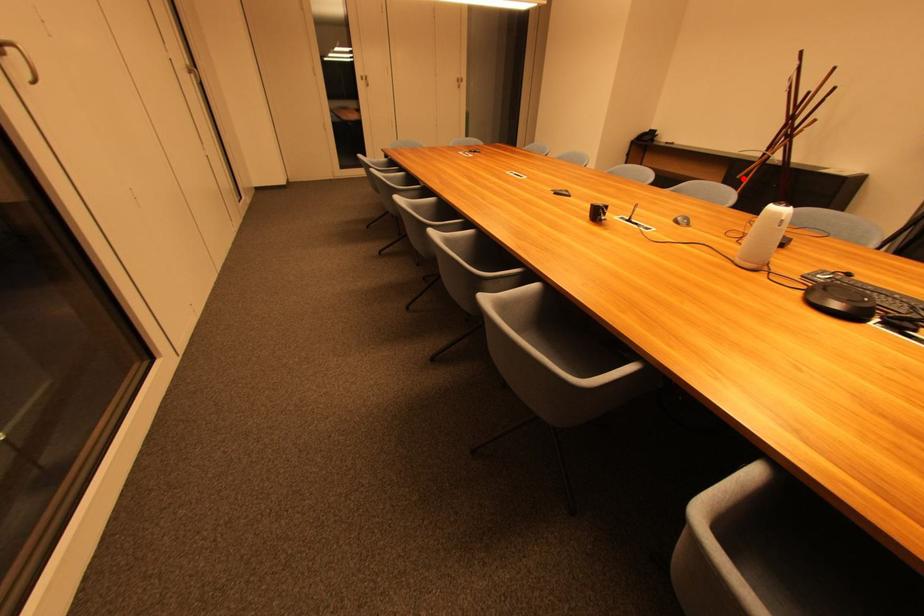
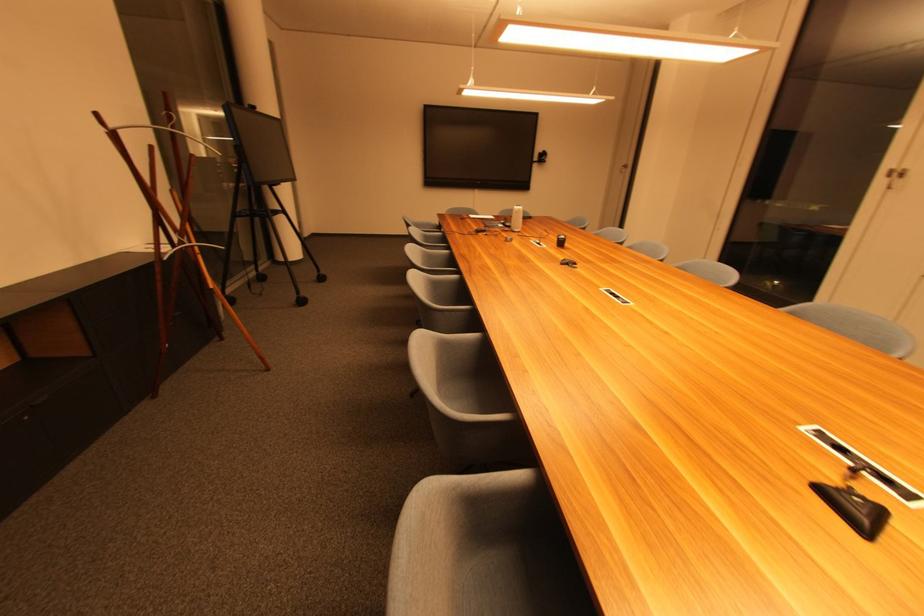
Where in the second image is the point corresponding to the highlighted location from the first image?

(216, 288)